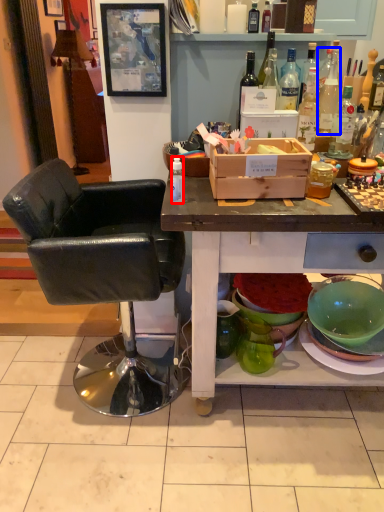
Question: Which object appears closest to the camera in this image, bottle (highlighted by a red box) or bottle (highlighted by a blue box)?

Choices:
 (A) bottle
 (B) bottle

Answer: (A)